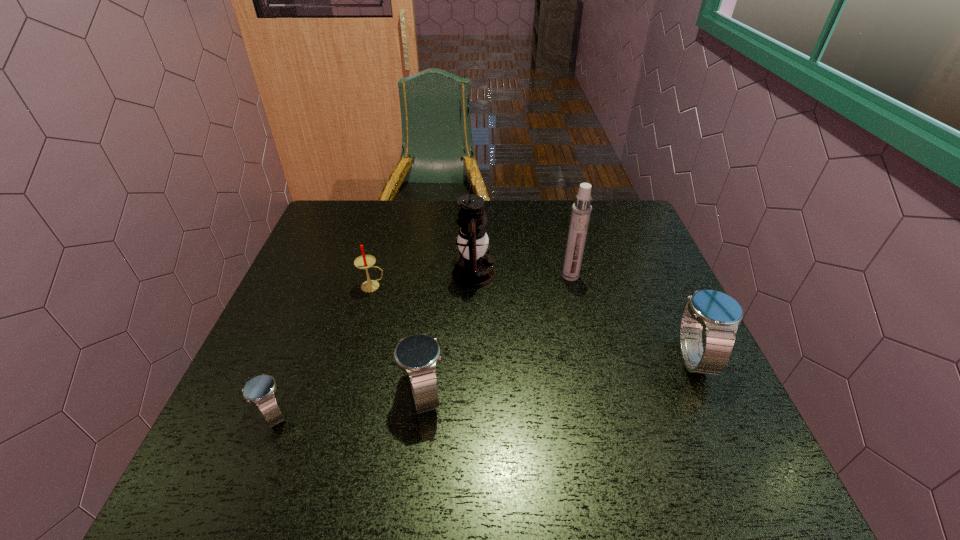
In the image, there is a desktop. Identify the location of vacant region at the far right corner. (609, 217).

This screenshot has width=960, height=540. What are the coordinates of `free region at the near right corner of the desktop` in the screenshot? It's located at (681, 431).

In order to click on vacant area that lies between the leftmost watch and the rightmost watch in this screenshot , I will do `click(483, 386)`.

The image size is (960, 540). I want to click on free space between the lantern and the second object from right to left, so click(522, 275).

Find the location of `unoccupied area between the lantern and the leftmost object`. unoccupied area between the lantern and the leftmost object is located at coordinates (373, 344).

Where is `free area in between the rightmost object and the leftmost watch`? The image size is (960, 540). free area in between the rightmost object and the leftmost watch is located at coordinates (483, 386).

Find the location of a particular element. The width and height of the screenshot is (960, 540). vacant space that's between the second object from left to right and the lantern is located at coordinates (423, 280).

You are a GUI agent. You are given a task and a screenshot of the screen. Output one action in this format:
    pyautogui.click(x=<x>, y=<y>)
    Task: Click on the vacant point located between the second shortest watch and the lantern
    The width and height of the screenshot is (960, 540).
    Given the screenshot: What is the action you would take?
    (x=449, y=334)

Find the location of a particular element. The width and height of the screenshot is (960, 540). vacant region between the second object from left to right and the leftmost watch is located at coordinates (324, 350).

The image size is (960, 540). I want to click on unoccupied position between the rightmost watch and the fifth object from right to left, so click(x=533, y=322).